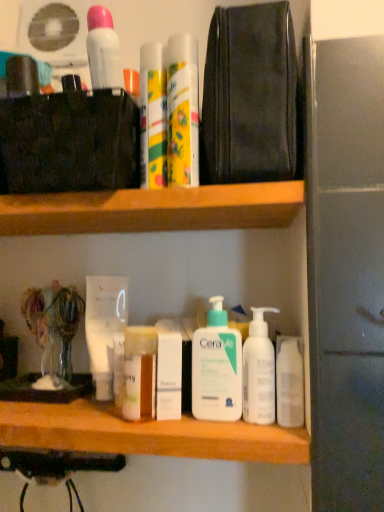
At what (x,y) coordinates should I click in order to perform the action: click on translucent plastic jar at center, which appears as the second toiletry when viewed from the top. Please return your answer as a coordinate pair (x, y). Looking at the image, I should click on tap(139, 372).

Measure the distance between wooden at upper center and camera.

wooden at upper center and camera are 21.48 inches apart.

The height and width of the screenshot is (512, 384). Describe the element at coordinates (153, 210) in the screenshot. I see `wooden at upper center` at that location.

Locate an element on the screen. The height and width of the screenshot is (512, 384). white pump bottle at center, acting as the first cleaning product starting from the right is located at coordinates (258, 371).

The height and width of the screenshot is (512, 384). What do you see at coordinates (103, 49) in the screenshot?
I see `white matte spray can at upper center, the 1th mouthwash positioned from the front` at bounding box center [103, 49].

Measure the distance between point (226,383) and camera.

The distance of point (226,383) from camera is 23.62 inches.

I want to click on white pump bottle at center, the 2th cleaning product positioned from the right, so click(217, 368).

Where is `white matte lotion at center, the first toiletry when ordered from bottom to top`? Image resolution: width=384 pixels, height=512 pixels. white matte lotion at center, the first toiletry when ordered from bottom to top is located at coordinates (169, 371).

Measure the distance between white matte lotion at center, the first toiletry when ordered from bottom to top, and camera.

60.26 centimeters.

The image size is (384, 512). What are the coordinates of `translucent plastic jar at center, which appears as the second toiletry when viewed from the top` in the screenshot? It's located at (139, 372).

Can we say translucent plastic jar at center, the 2th toiletry in the bottom-to-top sequence, lies outside white matte tube at center, which is the 1th mouthwash in bottom-to-top order?

That's correct, translucent plastic jar at center, the 2th toiletry in the bottom-to-top sequence, is outside of white matte tube at center, which is the 1th mouthwash in bottom-to-top order.

From their relative heights in the image, would you say translucent plastic jar at center, the 2th toiletry in the bottom-to-top sequence, is taller or shorter than white matte tube at center, the third mouthwash from the front?

translucent plastic jar at center, the 2th toiletry in the bottom-to-top sequence, is shorter than white matte tube at center, the third mouthwash from the front.

Is translucent plastic jar at center, the 2th toiletry in the bottom-to-top sequence, oriented towards white matte tube at center, the third mouthwash from the front?

No, translucent plastic jar at center, the 2th toiletry in the bottom-to-top sequence, is not facing towards white matte tube at center, the third mouthwash from the front.

Is white pump bottle at center, which is counted as the first cleaning product, starting from the left, looking in the opposite direction of white pump bottle at center, acting as the first cleaning product starting from the right?

white pump bottle at center, which is counted as the first cleaning product, starting from the left, does not have its back to white pump bottle at center, acting as the first cleaning product starting from the right.

Is white pump bottle at center, which is counted as the first cleaning product, starting from the left, closer to the viewer compared to white pump bottle at center, acting as the first cleaning product starting from the right?

No, white pump bottle at center, which is counted as the first cleaning product, starting from the left, is further to the viewer.

The image size is (384, 512). Find the location of `cleaning product on the left of white pump bottle at center, acting as the first cleaning product starting from the right`. cleaning product on the left of white pump bottle at center, acting as the first cleaning product starting from the right is located at coordinates (217, 368).

Considering the relative positions of white pump bottle at center, which is counted as the first cleaning product, starting from the left, and white pump bottle at center, arranged as the 2th cleaning product when viewed from the left, in the image provided, is white pump bottle at center, which is counted as the first cleaning product, starting from the left, to the left of white pump bottle at center, arranged as the 2th cleaning product when viewed from the left, from the viewer's perspective?

Yes.

Is white matte tube at center, arranged as the 3th mouthwash when viewed from the top, at the left side of white pump bottle at center, the 2th cleaning product positioned from the right?

Indeed, white matte tube at center, arranged as the 3th mouthwash when viewed from the top, is positioned on the left side of white pump bottle at center, the 2th cleaning product positioned from the right.

From a real-world perspective, is white matte tube at center, placed as the third mouthwash when sorted from right to left, physically above white pump bottle at center, which is counted as the first cleaning product, starting from the left?

Indeed, from a real-world perspective, white matte tube at center, placed as the third mouthwash when sorted from right to left, stands above white pump bottle at center, which is counted as the first cleaning product, starting from the left.

Is white matte tube at center, arranged as the 3th mouthwash when viewed from the top, turned away from white pump bottle at center, which is counted as the first cleaning product, starting from the left?

That's not correct — white matte tube at center, arranged as the 3th mouthwash when viewed from the top, is not looking away from white pump bottle at center, which is counted as the first cleaning product, starting from the left.

Which object is more forward, white matte tube at center, placed as the third mouthwash when sorted from right to left, or white pump bottle at center, which is counted as the first cleaning product, starting from the left?

white pump bottle at center, which is counted as the first cleaning product, starting from the left, is closer to the camera.

In the scene shown: Is floral-patterned plastic mouthwash at upper center, the 2th mouthwash positioned from the front, further to the viewer compared to matte plastic spray cans at upper center, the first toiletry when ordered from top to bottom?

No, it is not.

Can you confirm if floral-patterned plastic mouthwash at upper center, arranged as the second mouthwash when ordered from the bottom, is wider than matte plastic spray cans at upper center, the first toiletry when ordered from top to bottom?

Correct, the width of floral-patterned plastic mouthwash at upper center, arranged as the second mouthwash when ordered from the bottom, exceeds that of matte plastic spray cans at upper center, the first toiletry when ordered from top to bottom.

Would you consider floral-patterned plastic mouthwash at upper center, the 2th mouthwash positioned from the front, to be distant from matte plastic spray cans at upper center, the first toiletry when ordered from top to bottom?

No, floral-patterned plastic mouthwash at upper center, the 2th mouthwash positioned from the front, is not far away from matte plastic spray cans at upper center, the first toiletry when ordered from top to bottom.

Considering the relative positions of floral-patterned plastic mouthwash at upper center, which ranks as the 2th mouthwash in top-to-bottom order, and matte plastic spray cans at upper center, the first toiletry when ordered from top to bottom, in the image provided, is floral-patterned plastic mouthwash at upper center, which ranks as the 2th mouthwash in top-to-bottom order, to the right of matte plastic spray cans at upper center, the first toiletry when ordered from top to bottom, from the viewer's perspective?

Correct, you'll find floral-patterned plastic mouthwash at upper center, which ranks as the 2th mouthwash in top-to-bottom order, to the right of matte plastic spray cans at upper center, the first toiletry when ordered from top to bottom.

Consider the image. Which is in front, white matte lotion at center, the first toiletry when ordered from bottom to top, or black leather pouch at upper center?

black leather pouch at upper center is closer to the camera.

Is white matte lotion at center, the first toiletry when ordered from bottom to top, bigger or smaller than black leather pouch at upper center?

white matte lotion at center, the first toiletry when ordered from bottom to top, is smaller than black leather pouch at upper center.

Consider the image. Is white matte lotion at center, the first toiletry when ordered from bottom to top, taller than black leather pouch at upper center?

In fact, white matte lotion at center, the first toiletry when ordered from bottom to top, may be shorter than black leather pouch at upper center.

Is white matte tube at center, the 1th mouthwash positioned from the left, not close to white pump bottle at center, arranged as the 2th cleaning product when viewed from the left?

They are positioned close to each other.

Is white matte tube at center, which is the 1th mouthwash in bottom-to-top order, oriented away from white pump bottle at center, arranged as the 2th cleaning product when viewed from the left?

No, white matte tube at center, which is the 1th mouthwash in bottom-to-top order, is not facing away from white pump bottle at center, arranged as the 2th cleaning product when viewed from the left.

How different are the orientations of white matte tube at center, which ranks as the first mouthwash in back-to-front order, and white pump bottle at center, acting as the first cleaning product starting from the right, in degrees?

The angular difference between white matte tube at center, which ranks as the first mouthwash in back-to-front order, and white pump bottle at center, acting as the first cleaning product starting from the right, is 22.2 degrees.

From the image's perspective, relative to white pump bottle at center, acting as the first cleaning product starting from the right, is white matte tube at center, which ranks as the first mouthwash in back-to-front order, above or below?

From the image's perspective, white matte tube at center, which ranks as the first mouthwash in back-to-front order, appears above white pump bottle at center, acting as the first cleaning product starting from the right.

Is the position of white matte lotion at center, which ranks as the third toiletry in top-to-bottom order, more distant than that of white pump bottle at center, the 2th cleaning product positioned from the right?

Yes, white matte lotion at center, which ranks as the third toiletry in top-to-bottom order, is further from the camera.

Locate an element on the screen. This screenshot has height=512, width=384. toiletry behind the white pump bottle at center, the 2th cleaning product positioned from the right is located at coordinates (169, 371).

How many degrees apart are the facing directions of white matte lotion at center, the first toiletry when ordered from bottom to top, and white pump bottle at center, the 2th cleaning product positioned from the right?

0.000658 degrees separate the facing orientations of white matte lotion at center, the first toiletry when ordered from bottom to top, and white pump bottle at center, the 2th cleaning product positioned from the right.

In the scene shown: Considering the sizes of objects white matte lotion at center, which ranks as the third toiletry in top-to-bottom order, and white pump bottle at center, the 2th cleaning product positioned from the right, in the image provided, who is taller, white matte lotion at center, which ranks as the third toiletry in top-to-bottom order, or white pump bottle at center, the 2th cleaning product positioned from the right,?

With more height is white pump bottle at center, the 2th cleaning product positioned from the right.

Locate an element on the screen. This screenshot has height=512, width=384. the 2nd toiletry in front of the white matte tube at center, the third mouthwash from the front, starting your count from the anchor is located at coordinates (139, 372).

Locate an element on the screen. The height and width of the screenshot is (512, 384). cleaning product located behind the white pump bottle at center, acting as the first cleaning product starting from the right is located at coordinates (217, 368).

Estimate the real-world distances between objects in this image. Which object is closer to translucent plastic jar at center, the 2th toiletry in the bottom-to-top sequence, matte plastic spray cans at upper center, placed as the 3th toiletry when sorted from bottom to top, or white pump bottle at center, the 2th cleaning product positioned from the right?

white pump bottle at center, the 2th cleaning product positioned from the right, lies closer to translucent plastic jar at center, the 2th toiletry in the bottom-to-top sequence, than the other object.

From the image, which object appears to be farther from white matte lotion at center, which ranks as the third toiletry in top-to-bottom order, wooden at upper center or white pump bottle at center, which is counted as the first cleaning product, starting from the left?

The object further to white matte lotion at center, which ranks as the third toiletry in top-to-bottom order, is wooden at upper center.

Based on their spatial positions, is floral-patterned plastic mouthwash at upper center, arranged as the second mouthwash when ordered from the bottom, or white matte lotion at center, which ranks as the third toiletry in top-to-bottom order, closer to black leather pouch at upper center?

Based on the image, floral-patterned plastic mouthwash at upper center, arranged as the second mouthwash when ordered from the bottom, appears to be nearer to black leather pouch at upper center.

Which object lies further to the anchor point white matte tube at center, which is the 1th mouthwash in bottom-to-top order, floral-patterned plastic mouthwash at upper center, the third mouthwash when ordered from left to right, or matte plastic spray cans at upper center, the first toiletry when ordered from top to bottom?

The object further to white matte tube at center, which is the 1th mouthwash in bottom-to-top order, is floral-patterned plastic mouthwash at upper center, the third mouthwash when ordered from left to right.

Estimate the real-world distances between objects in this image. Which object is closer to matte plastic spray cans at upper center, placed as the 3th toiletry when sorted from bottom to top, white matte spray can at upper center, the 1th mouthwash positioned from the front, or white pump bottle at center, arranged as the 2th cleaning product when viewed from the left?

Among the two, white matte spray can at upper center, the 1th mouthwash positioned from the front, is located nearer to matte plastic spray cans at upper center, placed as the 3th toiletry when sorted from bottom to top.

Based on their spatial positions, is floral-patterned plastic mouthwash at upper center, placed as the first mouthwash when sorted from right to left, or black leather pouch at upper center further from matte plastic spray cans at upper center, placed as the 3th toiletry when sorted from bottom to top?

black leather pouch at upper center is positioned further to the anchor matte plastic spray cans at upper center, placed as the 3th toiletry when sorted from bottom to top.

Which object lies nearer to the anchor point translucent plastic jar at center, the 2th toiletry in the bottom-to-top sequence, white matte lotion at center, which ranks as the third toiletry in top-to-bottom order, or white matte tube at center, placed as the third mouthwash when sorted from right to left?

white matte lotion at center, which ranks as the third toiletry in top-to-bottom order, is closer to translucent plastic jar at center, the 2th toiletry in the bottom-to-top sequence.

From the image, which object appears to be nearer to black leather pouch at upper center, matte plastic spray cans at upper center, the first toiletry when ordered from top to bottom, or floral-patterned plastic mouthwash at upper center, the third mouthwash when ordered from left to right?

The object closer to black leather pouch at upper center is floral-patterned plastic mouthwash at upper center, the third mouthwash when ordered from left to right.

Locate an element on the screen. This screenshot has height=512, width=384. mouthwash between matte plastic spray cans at upper center, the first toiletry when ordered from top to bottom, and white pump bottle at center, arranged as the 2th cleaning product when viewed from the left, vertically is located at coordinates (104, 327).

Locate an element on the screen. This screenshot has height=512, width=384. pouch between white matte spray can at upper center, the third mouthwash positioned from the back, and white matte tube at center, which ranks as the first mouthwash in back-to-front order, in the up-down direction is located at coordinates (249, 96).

Where is `toiletry between black leather pouch at upper center and translucent plastic jar at center, the 2th toiletry in the bottom-to-top sequence, vertically`? The height and width of the screenshot is (512, 384). toiletry between black leather pouch at upper center and translucent plastic jar at center, the 2th toiletry in the bottom-to-top sequence, vertically is located at coordinates 152,117.

The width and height of the screenshot is (384, 512). I want to click on shelf that lies between white matte spray can at upper center, marked as the 2th mouthwash in a left-to-right arrangement, and white pump bottle at center, the 2th cleaning product positioned from the right, from top to bottom, so click(153, 210).